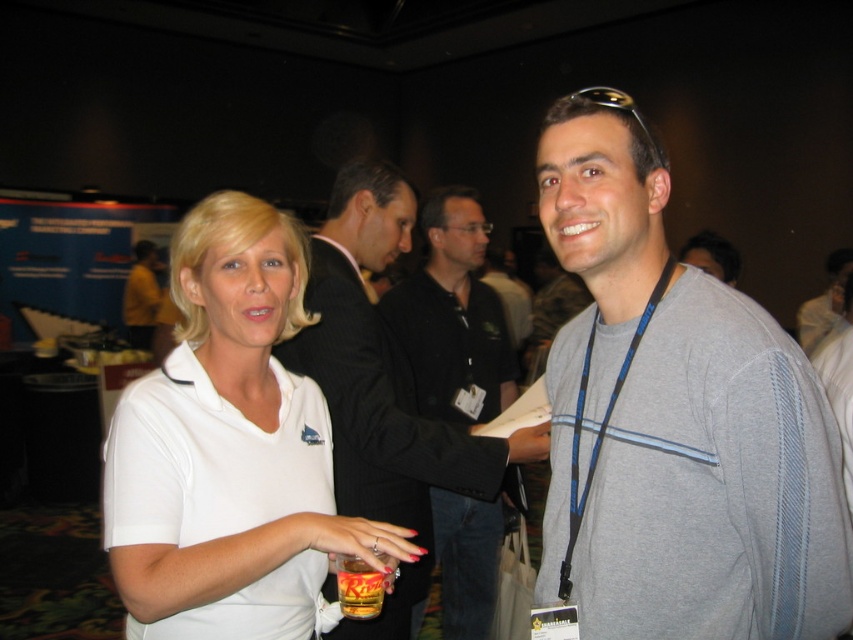
Can you confirm if gray fabric shirt at center is thinner than golden amber glass at lower center?

Incorrect, gray fabric shirt at center's width is not less than golden amber glass at lower center's.

From the picture: Is gray fabric shirt at center positioned in front of golden amber glass at lower center?

Yes, gray fabric shirt at center is closer to the viewer.

Does point (654, 566) come closer to viewer compared to point (351, 556)?

Yes, point (654, 566) is in front of point (351, 556).

Find the location of `gray fabric shirt at center`. gray fabric shirt at center is located at coordinates (675, 420).

Identify the location of matte black suit at center. Image resolution: width=853 pixels, height=640 pixels. (383, 388).

Consider the image. Can you confirm if matte black suit at center is smaller than golden amber glass at lower center?

Actually, matte black suit at center might be larger than golden amber glass at lower center.

Where is `matte black suit at center`? The image size is (853, 640). matte black suit at center is located at coordinates (383, 388).

Locate an element on the screen. The width and height of the screenshot is (853, 640). matte black suit at center is located at coordinates (383, 388).

Does point (595, 230) come in front of point (230, 333)?

Yes, point (595, 230) is in front of point (230, 333).

The height and width of the screenshot is (640, 853). What do you see at coordinates (675, 420) in the screenshot?
I see `gray fabric shirt at center` at bounding box center [675, 420].

This screenshot has height=640, width=853. What do you see at coordinates (675, 420) in the screenshot?
I see `gray fabric shirt at center` at bounding box center [675, 420].

Locate an element on the screen. Image resolution: width=853 pixels, height=640 pixels. gray fabric shirt at center is located at coordinates (675, 420).